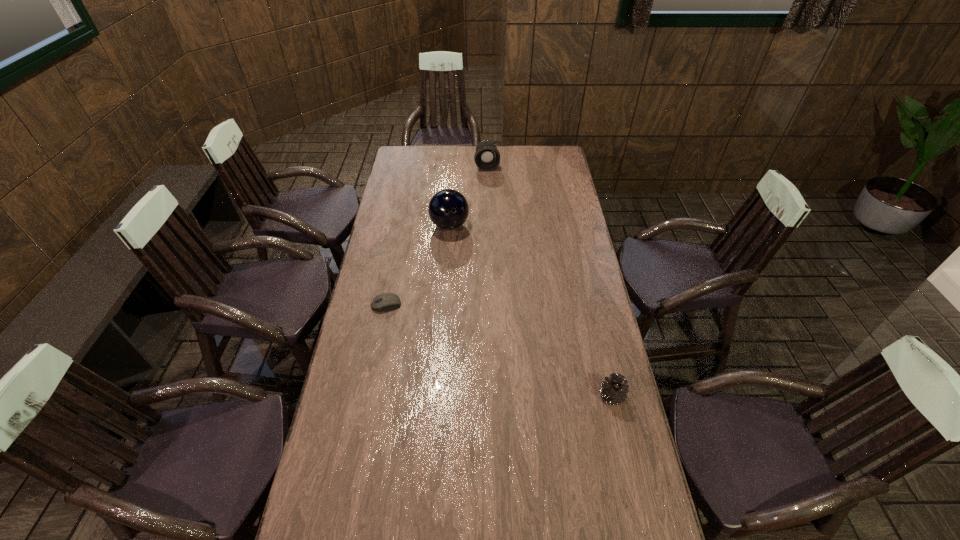
The width and height of the screenshot is (960, 540). Identify the location of vacant area situated at the front element of the second object from right to left. (489, 184).

Find the location of a particular element. vacant area situated 0.240m at the front element of the second object from right to left is located at coordinates (491, 199).

You are a GUI agent. You are given a task and a screenshot of the screen. Output one action in this format:
    pyautogui.click(x=<x>, y=<y>)
    Task: Click on the vacant space located at the front element of the second object from right to left
    The width and height of the screenshot is (960, 540).
    Given the screenshot: What is the action you would take?
    pyautogui.click(x=490, y=192)

The image size is (960, 540). Find the location of `free spot located 0.160m on the side of the tallest object with the finger holes`. free spot located 0.160m on the side of the tallest object with the finger holes is located at coordinates (468, 261).

Find the location of a particular element. Image resolution: width=960 pixels, height=540 pixels. vacant space situated 0.160m on the side of the tallest object with the finger holes is located at coordinates (468, 261).

Image resolution: width=960 pixels, height=540 pixels. Identify the location of vacant region located 0.270m on the side of the tallest object with the finger holes. (477, 279).

Identify the location of object positioned at the far edge. (487, 157).

The width and height of the screenshot is (960, 540). Identify the location of object at the left edge. (383, 302).

At what (x,y) coordinates should I click in order to perform the action: click on object located at the right edge. Please return your answer as a coordinate pair (x, y). Image resolution: width=960 pixels, height=540 pixels. Looking at the image, I should click on (614, 391).

The image size is (960, 540). In the image, there is a desktop. What are the coordinates of `blank space at the far edge` in the screenshot? It's located at tap(520, 146).